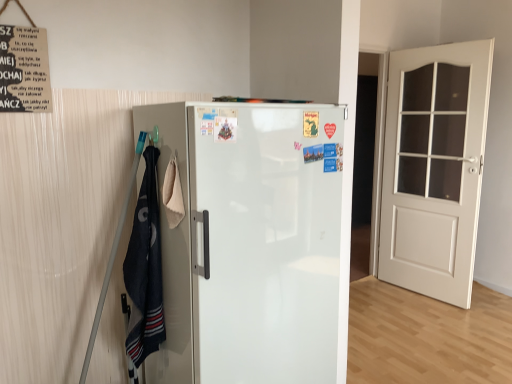
Find the location of `free location in front of white wood door at right`. free location in front of white wood door at right is located at coordinates (438, 321).